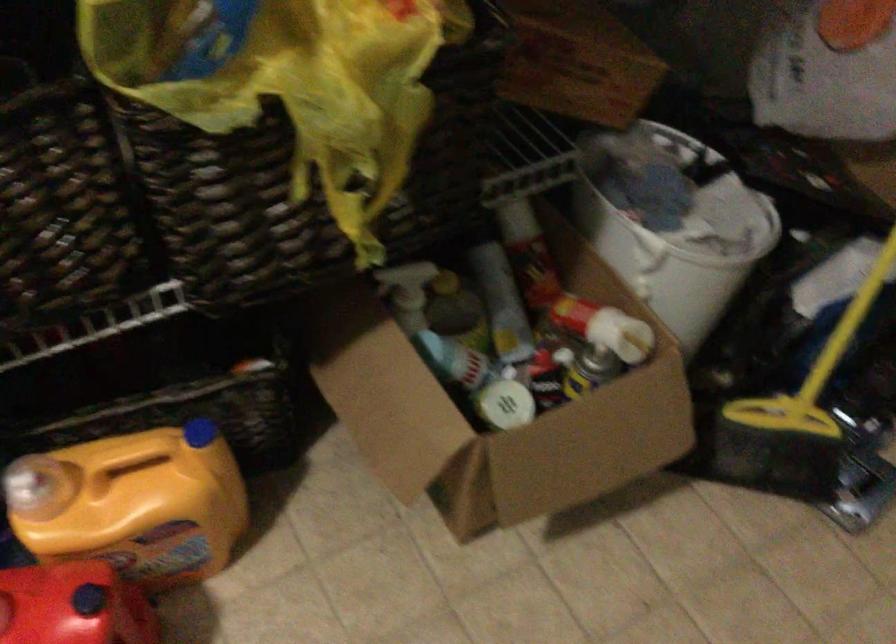
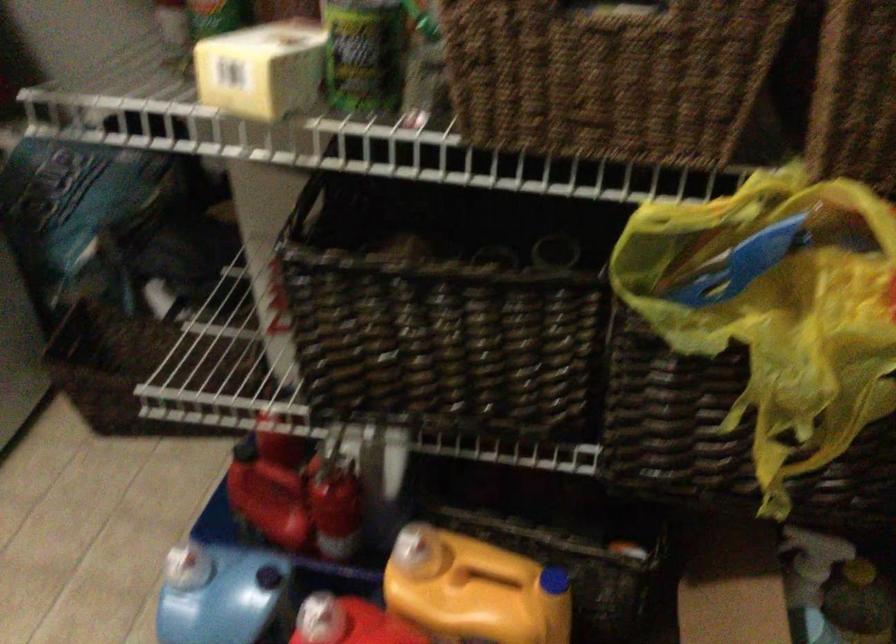
Question: The camera is either moving clockwise (left) or counter-clockwise (right) around the object. The first image is from the beginning of the video and the second image is from the end. Is the camera moving left or right when shooting the video?

Choices:
 (A) Left
 (B) Right

Answer: (B)